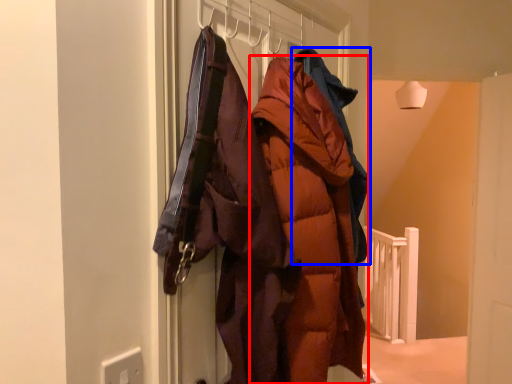
Question: Which object appears closest to the camera in this image, coat (highlighted by a red box) or jacket (highlighted by a blue box)?

Choices:
 (A) coat
 (B) jacket

Answer: (A)